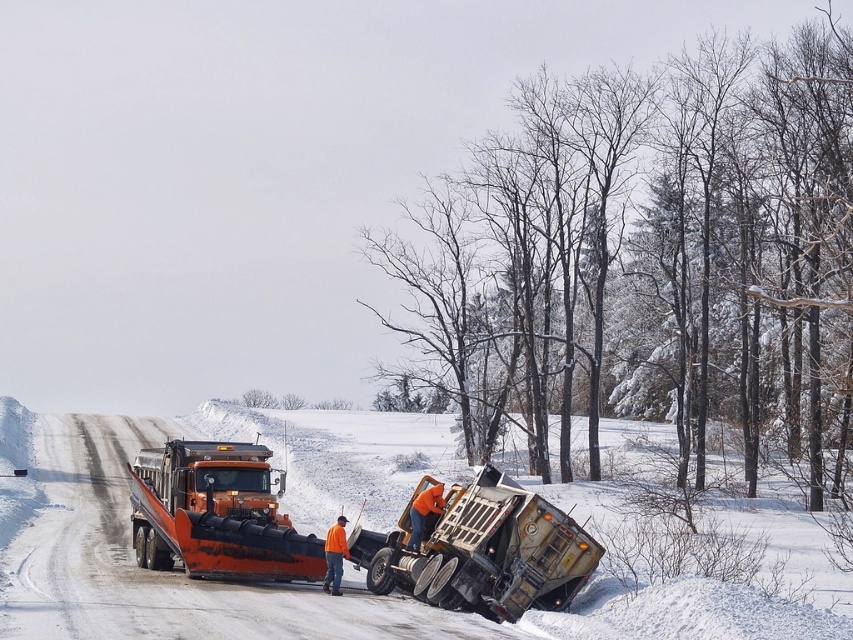
Question: Which object is positioned closest to the orange matte snowplow at left?

Choices:
 (A) orange metallic snowplow at lower center
 (B) white powdery snow at center

Answer: (A)

Question: Considering the relative positions of white powdery snow at center and orange metallic snowplow at lower center in the image provided, where is white powdery snow at center located with respect to orange metallic snowplow at lower center?

Choices:
 (A) right
 (B) left

Answer: (B)

Question: Which object appears closest to the camera in this image?

Choices:
 (A) orange matte snowplow at left
 (B) white powdery snow at center

Answer: (B)

Question: Can you confirm if white powdery snow at center is smaller than orange metallic snowplow at lower center?

Choices:
 (A) no
 (B) yes

Answer: (A)

Question: Is orange metallic snowplow at lower center closer to the viewer compared to orange matte snowplow at left?

Choices:
 (A) no
 (B) yes

Answer: (B)

Question: Which object is positioned closest to the orange matte snowplow at left?

Choices:
 (A) white powdery snow at center
 (B) orange metallic snowplow at lower center

Answer: (B)